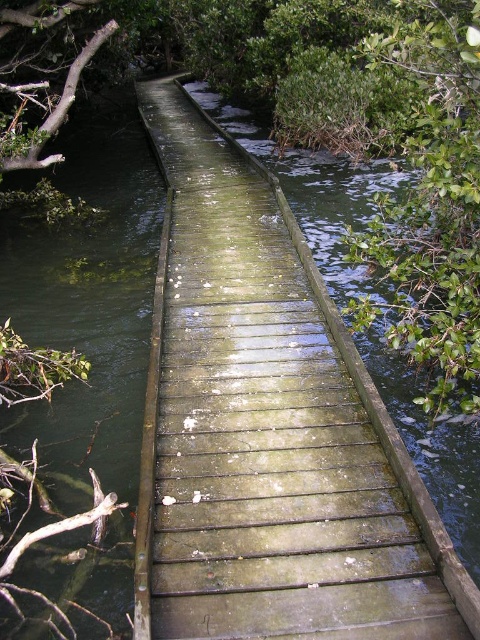
Is green mossy wood at center closer to the viewer compared to green leafy branch at upper left?

Yes.

Is green mossy wood at center above green leafy branch at upper left?

No.

Is point (308, 525) positioned behind point (13, 156)?

No, (308, 525) is closer to viewer.

Where is `green mossy wood at center`? The height and width of the screenshot is (640, 480). green mossy wood at center is located at coordinates (268, 428).

Who is shorter, green mossy wood at center or green leafy tree at right?

Standing shorter between the two is green leafy tree at right.

From the picture: Is green mossy wood at center positioned at the back of green leafy tree at right?

No, green mossy wood at center is closer to the viewer.

Image resolution: width=480 pixels, height=640 pixels. In order to click on green mossy wood at center in this screenshot , I will do `click(268, 428)`.

Find the location of a particular element. Image resolution: width=480 pixels, height=640 pixels. green leafy tree at right is located at coordinates (432, 204).

Does green leafy tree at right appear on the right side of green leafy branch at upper left?

Indeed, green leafy tree at right is positioned on the right side of green leafy branch at upper left.

Which is in front, point (465, 49) or point (80, 70)?

Point (465, 49)

I want to click on green leafy tree at right, so click(432, 204).